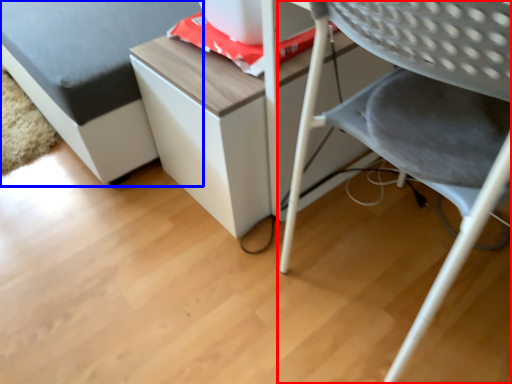
Question: Among these objects, which one is nearest to the camera, chair (highlighted by a red box) or furniture (highlighted by a blue box)?

Choices:
 (A) chair
 (B) furniture

Answer: (A)